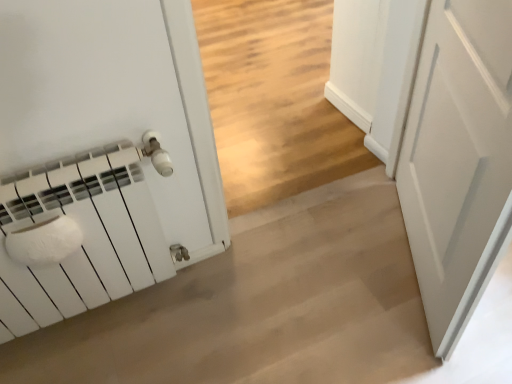
Question: Considering their positions, is white matte door at right located in front of or behind white matte radiator at left?

Choices:
 (A) front
 (B) behind

Answer: (A)

Question: Considering the positions of point (419, 243) and point (416, 284), is point (419, 243) closer or farther from the camera than point (416, 284)?

Choices:
 (A) farther
 (B) closer

Answer: (B)

Question: Would you say white matte door at right is inside or outside white matte radiator at left?

Choices:
 (A) inside
 (B) outside

Answer: (B)

Question: Looking at the image, does white matte radiator at left seem bigger or smaller compared to white matte door at right?

Choices:
 (A) big
 (B) small

Answer: (A)

Question: Is white matte radiator at left spatially inside white matte door at right, or outside of it?

Choices:
 (A) inside
 (B) outside

Answer: (B)

Question: Is white matte radiator at left wider or thinner than white matte door at right?

Choices:
 (A) wide
 (B) thin

Answer: (A)

Question: Is point (279, 354) closer or farther from the camera than point (495, 18)?

Choices:
 (A) closer
 (B) farther

Answer: (B)